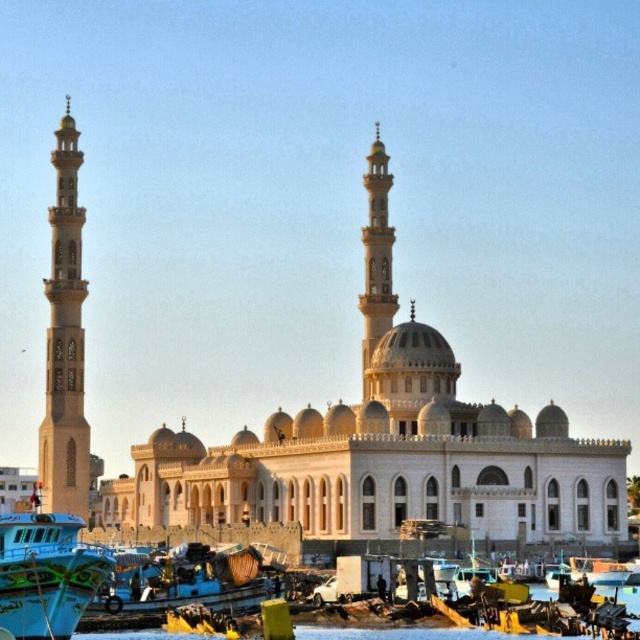
Is blue painted wooden boat at lower left taller than beige stone minaret at center?

In fact, blue painted wooden boat at lower left may be shorter than beige stone minaret at center.

Between point (70, 518) and point (384, 220), which one is positioned in front?

Positioned in front is point (70, 518).

Where is `blue painted wooden boat at lower left`? blue painted wooden boat at lower left is located at coordinates (45, 573).

You are a GUI agent. You are given a task and a screenshot of the screen. Output one action in this format:
    pyautogui.click(x=<x>, y=<y>)
    Task: Click on the beige stone minaret at left
    Image resolution: width=640 pixels, height=640 pixels.
    Given the screenshot: What is the action you would take?
    pyautogui.click(x=65, y=340)

Is beige stone minaret at left bigger than blue painted wood boat at lower left?

Correct, beige stone minaret at left is larger in size than blue painted wood boat at lower left.

Image resolution: width=640 pixels, height=640 pixels. I want to click on beige stone minaret at left, so click(65, 340).

Is beige stone minaret at center smaller than clear water at lower center?

Actually, beige stone minaret at center might be larger than clear water at lower center.

Can you confirm if beige stone minaret at center is positioned to the left of clear water at lower center?

No, beige stone minaret at center is not to the left of clear water at lower center.

Between point (374, 131) and point (141, 636), which one is positioned behind?

The point (374, 131) is more distant.

Locate an element on the screen. The height and width of the screenshot is (640, 640). beige stone minaret at center is located at coordinates (376, 257).